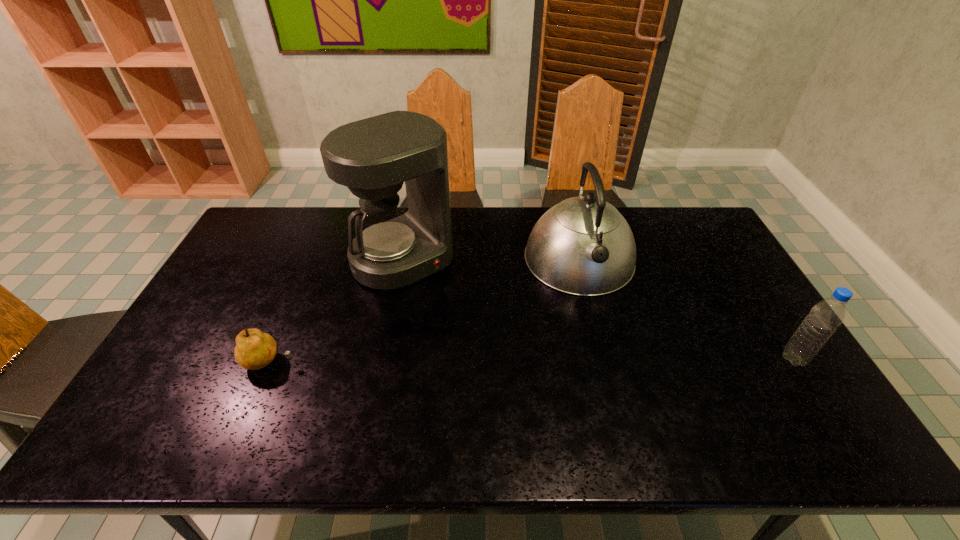
In order to click on vacant space on the desktop that is between the leftmost object and the rightmost object and is positioned on the front-facing side of the tallest object in this screenshot , I will do `click(497, 360)`.

This screenshot has width=960, height=540. Identify the location of free space on the desktop that is between the shortest object and the water bottle and is positioned from the spout of the third shortest object. coord(610,360).